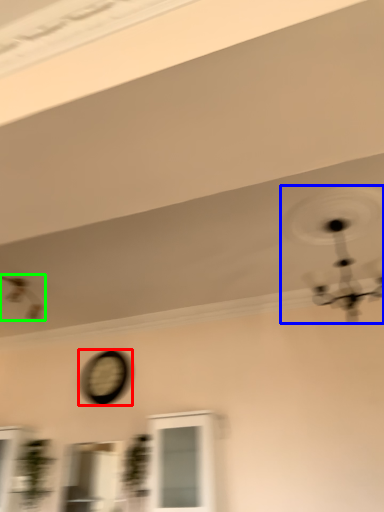
Question: Based on their relative distances, which object is nearer to clock (highlighted by a red box)? Choose from mechanical fan (highlighted by a blue box) and mechanical fan (highlighted by a green box).

Choices:
 (A) mechanical fan
 (B) mechanical fan

Answer: (B)